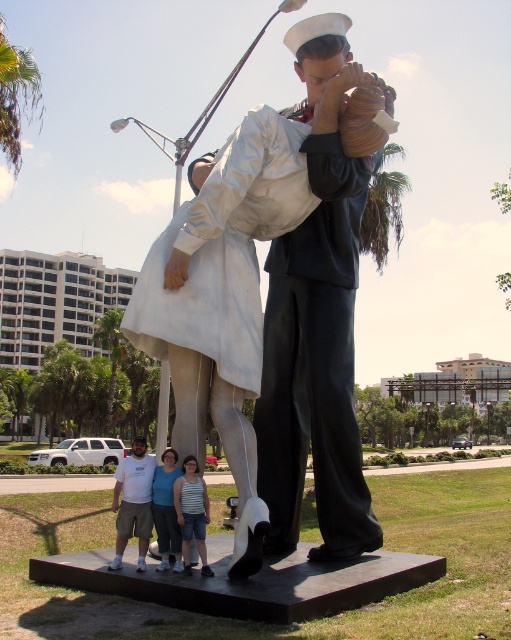
Is white cotton t-shirt at lower center wider than white matte shirt at lower center?

Indeed, white cotton t-shirt at lower center has a greater width compared to white matte shirt at lower center.

Can you confirm if white cotton t-shirt at lower center is positioned below white matte shirt at lower center?

No, white cotton t-shirt at lower center is not below white matte shirt at lower center.

Is point (124, 515) positioned after point (127, 465)?

No, it is not.

Where is `white cotton t-shirt at lower center`? The height and width of the screenshot is (640, 511). white cotton t-shirt at lower center is located at coordinates (143, 500).

Does white glossy statue at center have a greater height compared to white matte shirt at lower center?

Yes.

From the picture: Between white glossy statue at center and white matte shirt at lower center, which one has more height?

white glossy statue at center

Identify the location of white glossy statue at center. This screenshot has width=511, height=640. pyautogui.click(x=222, y=300).

Where is `white glossy statue at center`? white glossy statue at center is located at coordinates (222, 300).

Who is more forward, (x=257, y=500) or (x=137, y=499)?

Point (x=257, y=500) is in front.

Is white glossy statue at center in front of white cotton t-shirt at lower center?

Yes, white glossy statue at center is closer to the viewer.

Does point (314, 44) come behind point (129, 518)?

That is True.

Locate an element on the screen. white glossy statue at center is located at coordinates (222, 300).